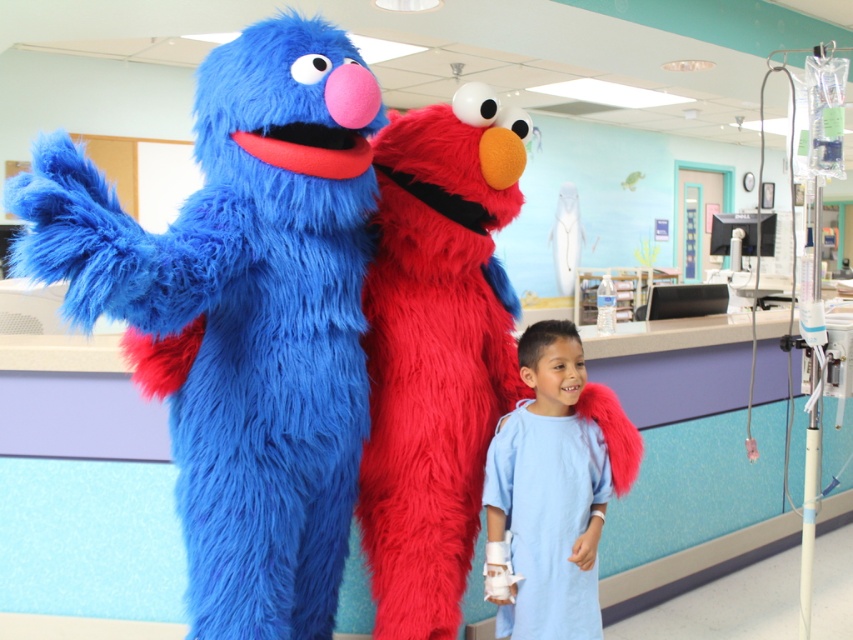
Question: Which point appears closest to the camera in this image?

Choices:
 (A) click(x=434, y=400)
 (B) click(x=506, y=467)

Answer: (A)

Question: Does fuzzy blue grover at left appear over fluffy red elmo at center?

Choices:
 (A) yes
 (B) no

Answer: (A)

Question: Which point appears closest to the camera in this image?

Choices:
 (A) (200, 336)
 (B) (544, 483)
 (C) (403, 497)

Answer: (A)

Question: From the image, what is the correct spatial relationship of fluffy red elmo at center in relation to light blue fabric gown at lower center?

Choices:
 (A) right
 (B) left

Answer: (B)

Question: Does fuzzy blue grover at left come behind light blue fabric gown at lower center?

Choices:
 (A) yes
 (B) no

Answer: (B)

Question: Which object appears farthest from the camera in this image?

Choices:
 (A) light blue fabric gown at lower center
 (B) fluffy red elmo at center

Answer: (A)